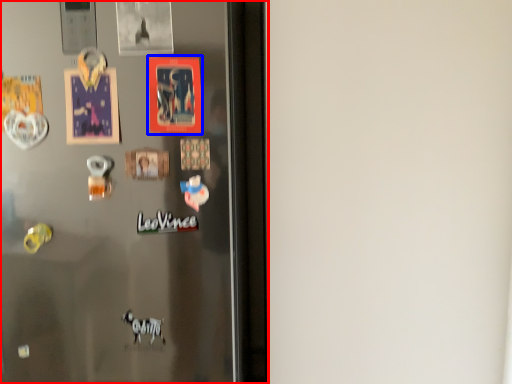
Question: Which object appears farthest to the camera in this image, refrigerator (highlighted by a red box) or postcard (highlighted by a blue box)?

Choices:
 (A) refrigerator
 (B) postcard

Answer: (B)